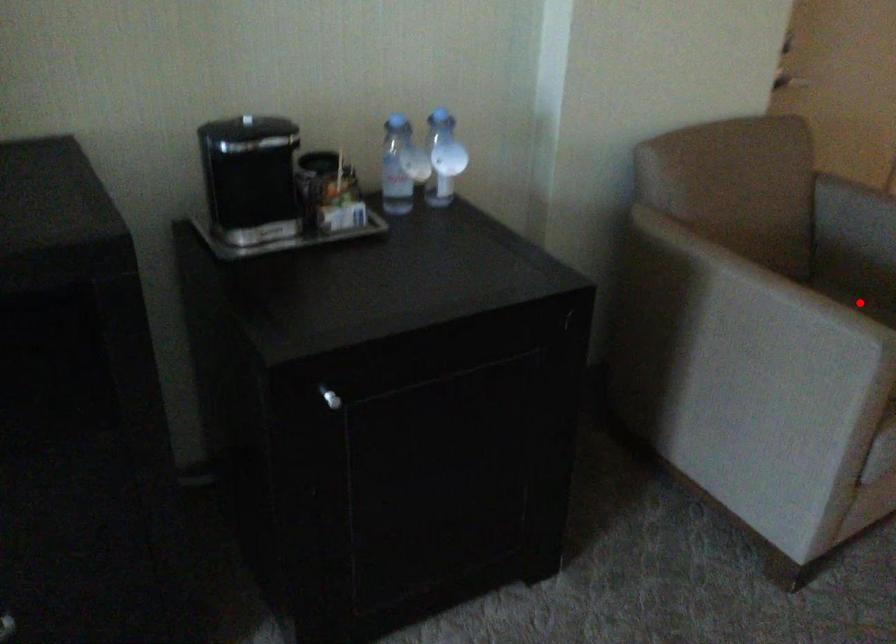
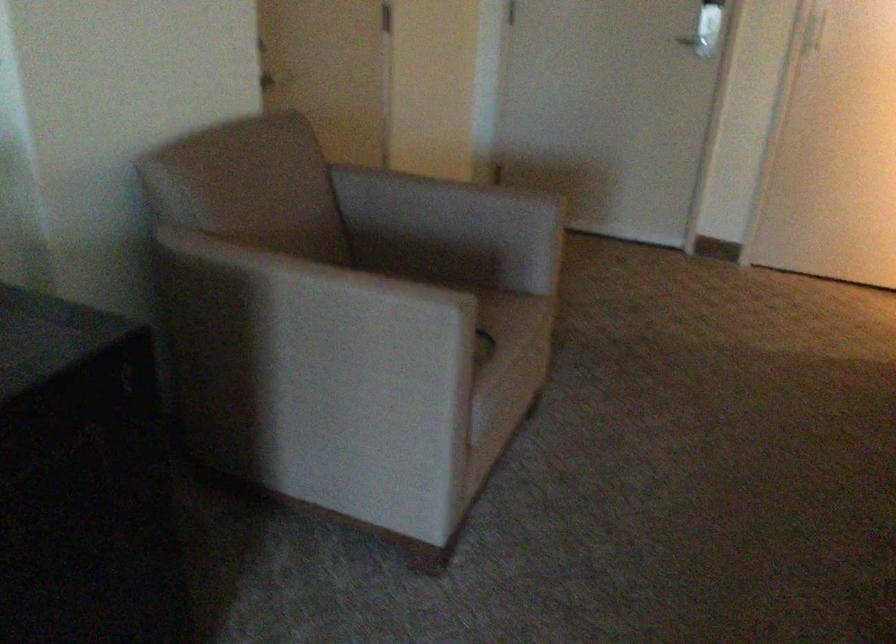
Locate, in the second image, the point that corresponds to the highlighted location in the first image.

(401, 285)